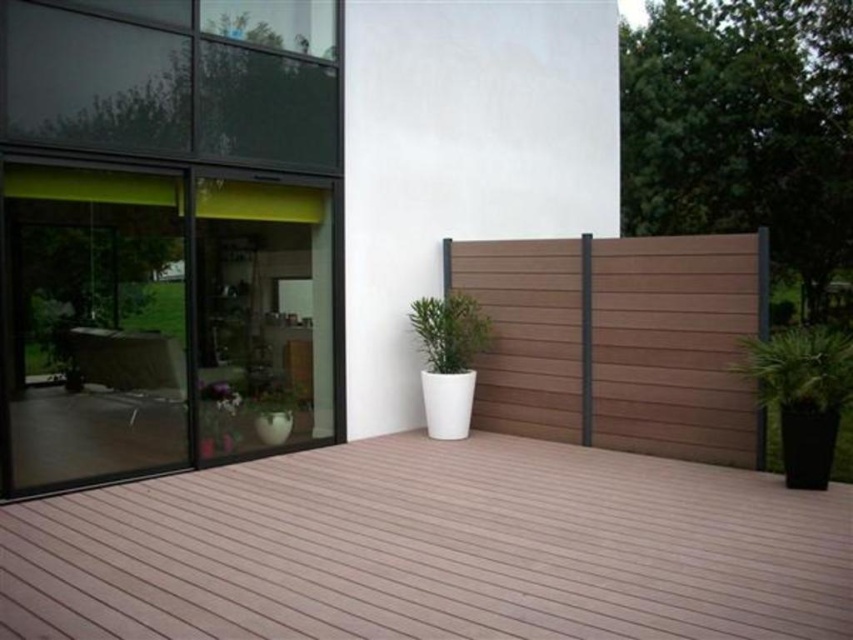
Is brown wood deck at center to the left of transparent glass screen door at center from the viewer's perspective?

Incorrect, brown wood deck at center is not on the left side of transparent glass screen door at center.

Who is more distant from viewer, [154,621] or [202,218]?

The point [202,218] is behind.

Which is behind, point (602, 516) or point (318, 198)?

The point (318, 198) is more distant.

Find the location of a particular element. brown wood deck at center is located at coordinates (433, 548).

Between transparent glass screen door at left and green matte plant at center, which one is positioned higher?

transparent glass screen door at left

In the scene shown: Can you confirm if transparent glass screen door at left is taller than green matte plant at center?

Yes.

Is point (33, 192) less distant than point (456, 332)?

Yes, it is in front of point (456, 332).

Where is `transparent glass screen door at left`? The image size is (853, 640). transparent glass screen door at left is located at coordinates (91, 323).

Can you confirm if green matte plant at right is bigger than green matte plant at center?

Yes, green matte plant at right is bigger than green matte plant at center.

Is green matte plant at right to the left of green matte plant at center from the viewer's perspective?

In fact, green matte plant at right is to the right of green matte plant at center.

Measure the distance between point [824,342] and camera.

Point [824,342] is 18.59 feet from camera.

You are a GUI agent. You are given a task and a screenshot of the screen. Output one action in this format:
    pyautogui.click(x=<x>, y=<y>)
    Task: Click on the green matte plant at right
    Image resolution: width=853 pixels, height=640 pixels.
    Given the screenshot: What is the action you would take?
    799,369